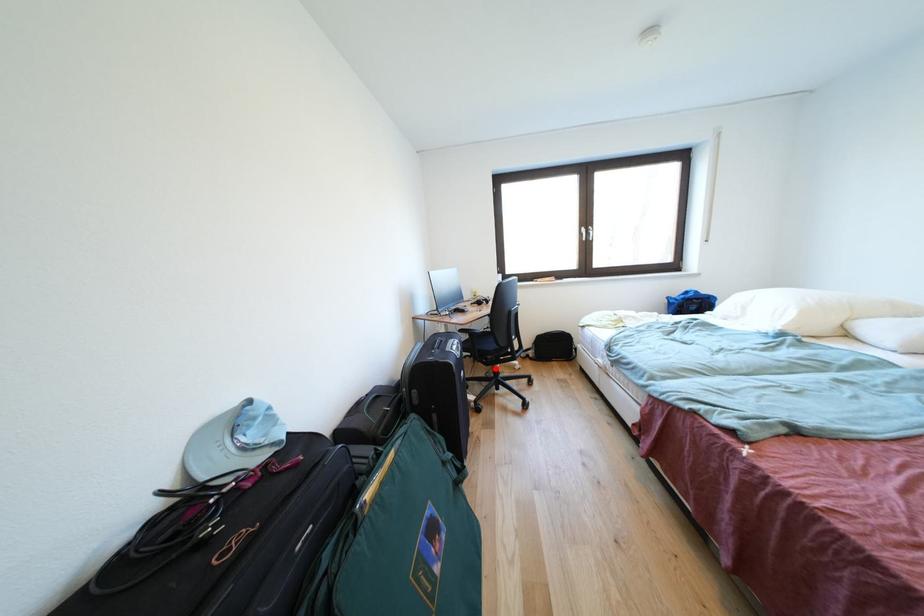
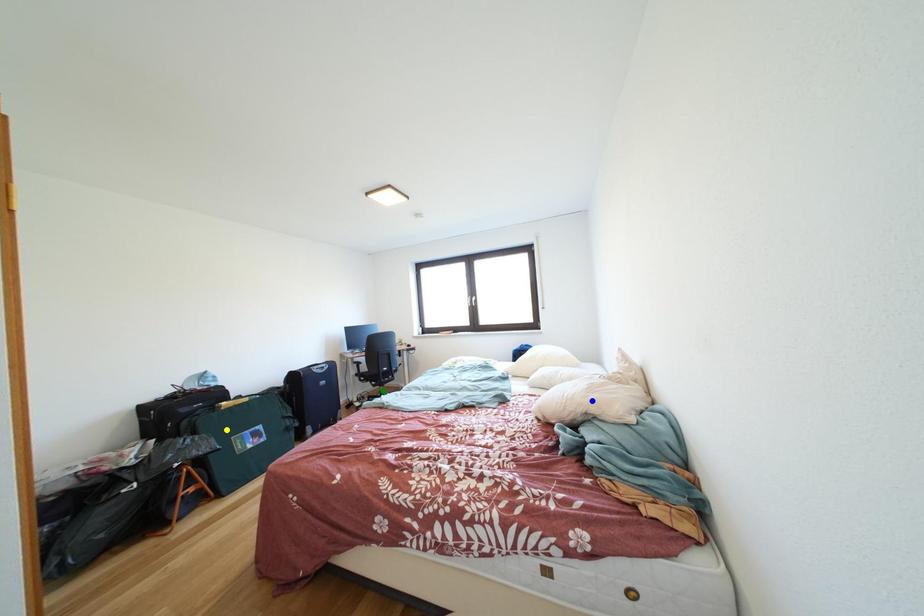
Question: I am providing you with two images of the same scene from different viewpoints. A red point is marked on the first image. You are given multiple points on the second image. Which mark in image 2 goes with the point in image 1?

Choices:
 (A) yellow point
 (B) blue point
 (C) green point

Answer: (C)